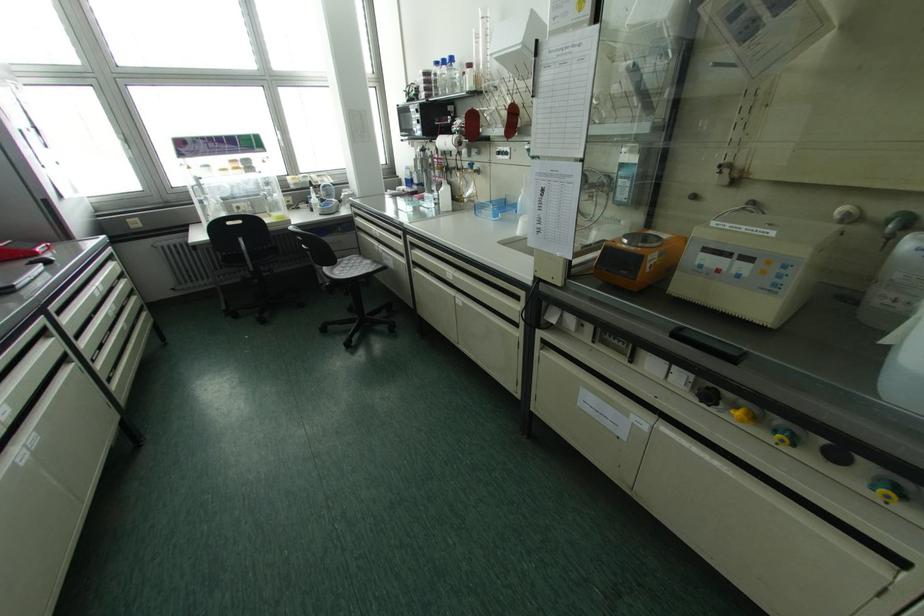
The height and width of the screenshot is (616, 924). What are the coordinates of `black chair sitting surface` in the screenshot? It's located at point(349,269).